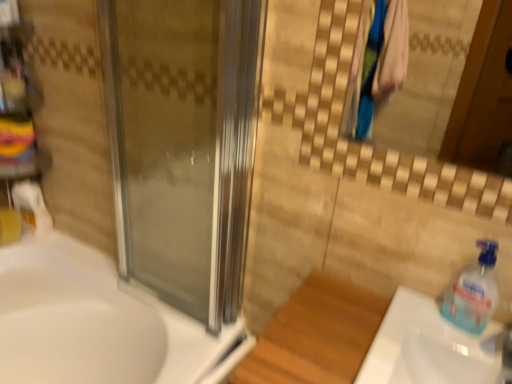
Locate an element on the screen. The width and height of the screenshot is (512, 384). vacant region in front of transparent glass screen door at center is located at coordinates (176, 343).